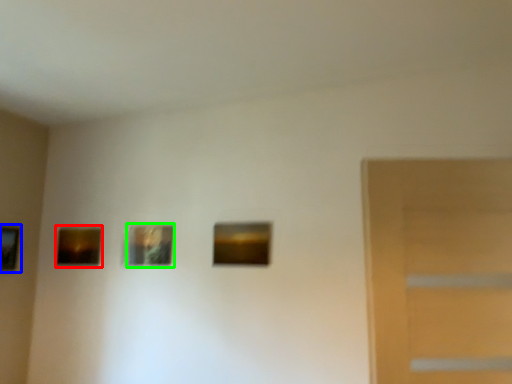
Question: Which object is positioned closest to picture frame (highlighted by a red box)? Select from picture frame (highlighted by a blue box) and picture frame (highlighted by a green box).

Choices:
 (A) picture frame
 (B) picture frame

Answer: (A)